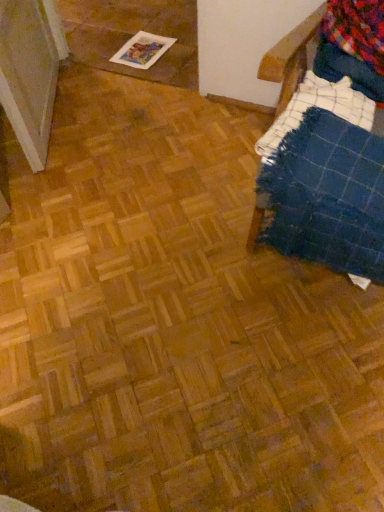
Question: Can you confirm if multicolored flannel at upper right is bigger than printed paper magazine at upper left?

Choices:
 (A) no
 (B) yes

Answer: (B)

Question: Does multicolored flannel at upper right turn towards printed paper magazine at upper left?

Choices:
 (A) no
 (B) yes

Answer: (A)

Question: Considering the relative positions of multicolored flannel at upper right and printed paper magazine at upper left in the image provided, is multicolored flannel at upper right to the right of printed paper magazine at upper left from the viewer's perspective?

Choices:
 (A) yes
 (B) no

Answer: (A)

Question: Is multicolored flannel at upper right behind printed paper magazine at upper left?

Choices:
 (A) no
 (B) yes

Answer: (A)

Question: From the image's perspective, is multicolored flannel at upper right below printed paper magazine at upper left?

Choices:
 (A) no
 (B) yes

Answer: (B)

Question: Is multicolored flannel at upper right shorter than printed paper magazine at upper left?

Choices:
 (A) no
 (B) yes

Answer: (A)

Question: Does printed paper magazine at upper left appear on the left side of multicolored flannel at upper right?

Choices:
 (A) no
 (B) yes

Answer: (B)

Question: Can you confirm if printed paper magazine at upper left is positioned to the right of multicolored flannel at upper right?

Choices:
 (A) no
 (B) yes

Answer: (A)

Question: Is printed paper magazine at upper left facing away from multicolored flannel at upper right?

Choices:
 (A) no
 (B) yes

Answer: (A)

Question: Considering the relative sizes of printed paper magazine at upper left and multicolored flannel at upper right in the image provided, is printed paper magazine at upper left bigger than multicolored flannel at upper right?

Choices:
 (A) no
 (B) yes

Answer: (A)

Question: From a real-world perspective, is printed paper magazine at upper left positioned over multicolored flannel at upper right based on gravity?

Choices:
 (A) yes
 (B) no

Answer: (B)

Question: Can you confirm if printed paper magazine at upper left is taller than multicolored flannel at upper right?

Choices:
 (A) yes
 (B) no

Answer: (B)

Question: Considering the relative sizes of multicolored flannel at upper right and blue plaid blanket at right in the image provided, is multicolored flannel at upper right taller than blue plaid blanket at right?

Choices:
 (A) no
 (B) yes

Answer: (A)